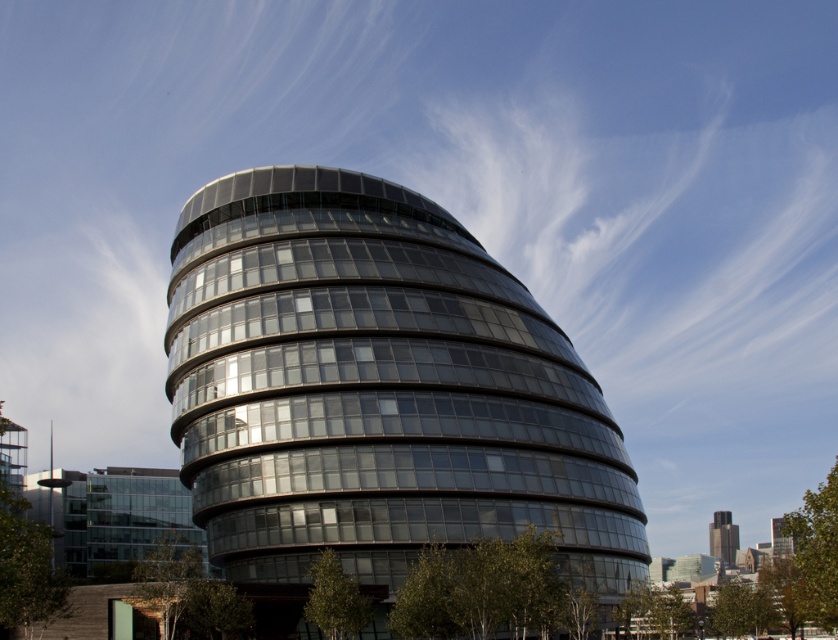
Question: Which object appears closest to the camera in this image?

Choices:
 (A) transparent glass building at center
 (B) dark gray concrete tower at lower right

Answer: (A)

Question: Which object appears closest to the camera in this image?

Choices:
 (A) dark gray concrete tower at lower right
 (B) transparent glass building at center

Answer: (B)

Question: Is transparent glass building at center wider than dark gray concrete tower at lower right?

Choices:
 (A) yes
 (B) no

Answer: (A)

Question: Is transparent glass building at center below dark gray concrete tower at lower right?

Choices:
 (A) yes
 (B) no

Answer: (B)

Question: Which object appears closest to the camera in this image?

Choices:
 (A) transparent glass building at center
 (B) dark gray concrete tower at lower right

Answer: (A)

Question: Does transparent glass building at center have a lesser width compared to dark gray concrete tower at lower right?

Choices:
 (A) no
 (B) yes

Answer: (A)